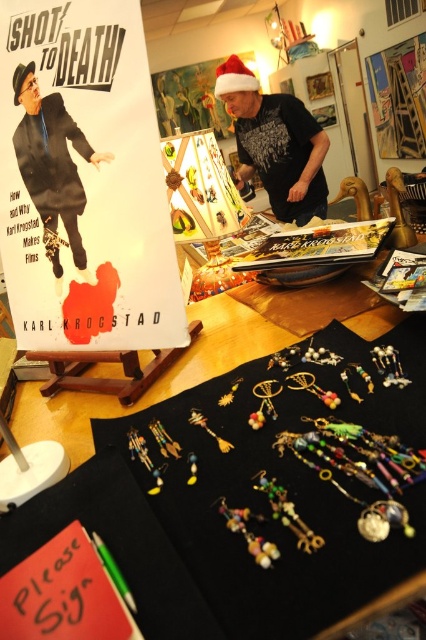
You are a visitor at the craft fair and want to take a photo of both the matte black suit at upper left and the matte paper poster at upper center. The camera you have can only focus on objects within a 10 feet range. Can you capture both items in one shot without moving?

The matte black suit at upper left and the matte paper poster at upper center are 12.82 feet apart from each other. Since the camera can only focus within 10 feet, the distance between them exceeds the camera range, so you cannot capture both in one shot without moving.

You are holding a camera and want to take a photo of the point at coordinates (x=124, y=348). If the camera is currently 58.27 centimeters away from the point, is it within the ideal focus range of 50 to 60 centimeters for clear photos?

The point at (x=124, y=348) is 58.27 centimeters away from the camera, which falls within the ideal focus range of 50 to 60 centimeters. Therefore, the camera is within the ideal focus range for a clear photo.

You are at the craft fair and want to know which of the two points, point (57, 180) or point (405, 122), is closer to you. Based on the scene, which point is nearer?

Point (57, 180) is closer to the viewer than point (405, 122).